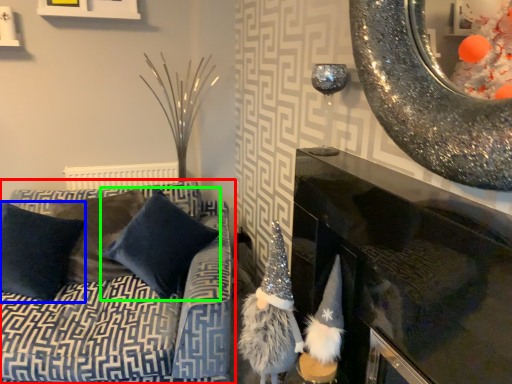
Question: Which object is the closest to the studio couch (highlighted by a red box)? Choose among these: pillow (highlighted by a blue box) or pillow (highlighted by a green box).

Choices:
 (A) pillow
 (B) pillow

Answer: (B)